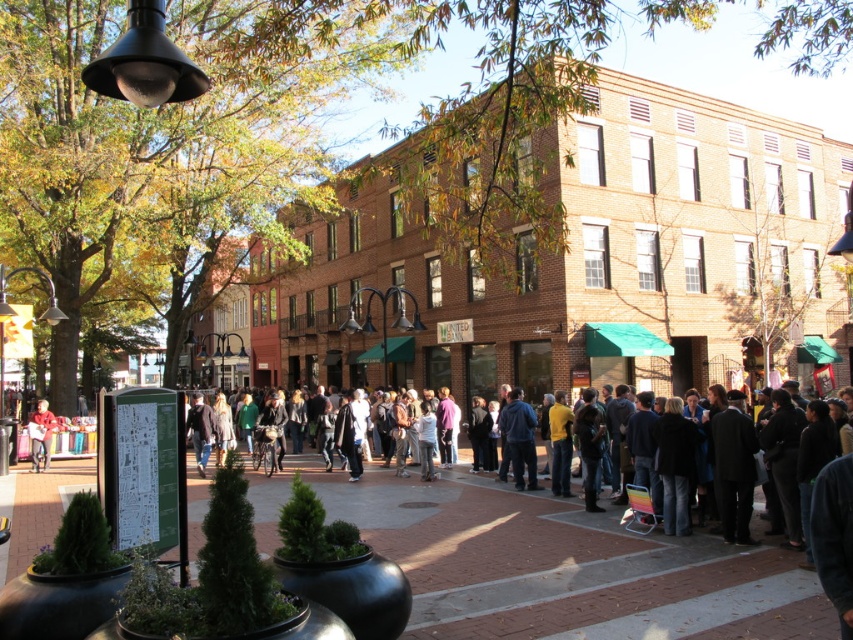
Question: Is brick pavement at center positioned before matte black jacket at left?

Choices:
 (A) no
 (B) yes

Answer: (B)

Question: Can you confirm if brick pavement at center is wider than matte black jacket at left?

Choices:
 (A) yes
 (B) no

Answer: (A)

Question: Which object is farther from the camera taking this photo?

Choices:
 (A) matte black jacket at left
 (B) brick pavement at center

Answer: (A)

Question: Can you confirm if brick pavement at center is smaller than matte black jacket at left?

Choices:
 (A) yes
 (B) no

Answer: (B)

Question: Which object appears farthest from the camera in this image?

Choices:
 (A) matte black jacket at left
 (B) brick pavement at center

Answer: (A)